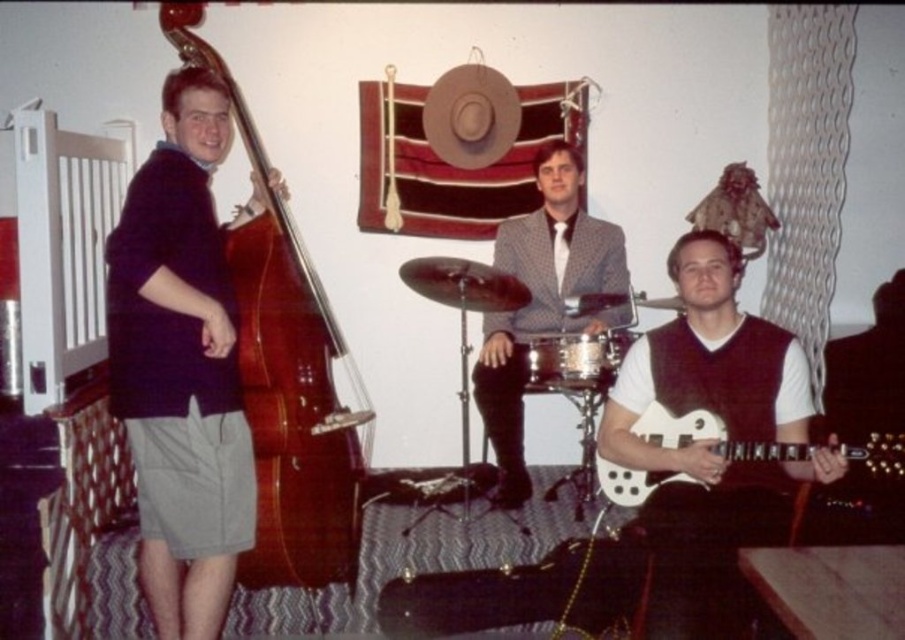
You are setting up a music room and need to place the glossy wood cello at left and the shiny silver drum at center. Given their sizes, which one requires more space for proper placement?

The glossy wood cello at left requires more space for proper placement because it is larger in size than the shiny silver drum at center.